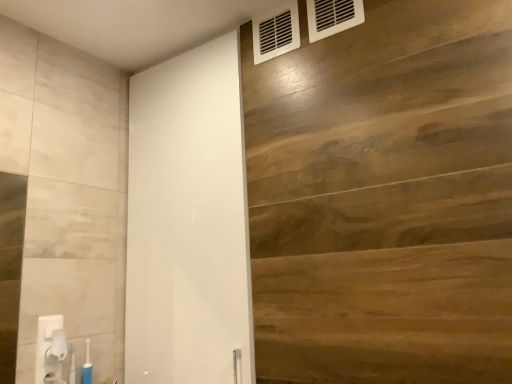
Question: From the image's perspective, is white glossy barn door at center located beneath white plastic vent at upper right, which is the 2th air conditioning from front to back?

Choices:
 (A) no
 (B) yes

Answer: (B)

Question: From the image's perspective, would you say white glossy barn door at center is positioned over white plastic vent at upper right, the 1th air conditioning when ordered from back to front?

Choices:
 (A) no
 (B) yes

Answer: (A)

Question: Does white glossy barn door at center appear on the right side of white plastic vent at upper right, placed as the 1th air conditioning when sorted from left to right?

Choices:
 (A) yes
 (B) no

Answer: (B)

Question: Does white glossy barn door at center appear on the left side of white plastic vent at upper right, which is the 2th air conditioning from front to back?

Choices:
 (A) yes
 (B) no

Answer: (A)

Question: From a real-world perspective, is white glossy barn door at center positioned under white plastic vent at upper right, the 1th air conditioning when ordered from back to front, based on gravity?

Choices:
 (A) yes
 (B) no

Answer: (A)

Question: Is wooden panel at upper right bigger or smaller than white plastic air conditioning at upper right, the first air conditioning positioned from the right?

Choices:
 (A) small
 (B) big

Answer: (B)

Question: Is wooden panel at upper right inside or outside of white plastic air conditioning at upper right, the first air conditioning positioned from the right?

Choices:
 (A) outside
 (B) inside

Answer: (A)

Question: From the image's perspective, is wooden panel at upper right above or below white plastic air conditioning at upper right, acting as the 2th air conditioning starting from the left?

Choices:
 (A) below
 (B) above

Answer: (A)

Question: From a real-world perspective, relative to white plastic air conditioning at upper right, which appears as the first air conditioning when viewed from the front, is wooden panel at upper right vertically above or below?

Choices:
 (A) above
 (B) below

Answer: (B)

Question: In the image, is white glossy barn door at center positioned in front of or behind wooden panel at upper right?

Choices:
 (A) front
 (B) behind

Answer: (B)

Question: Is white glossy barn door at center inside or outside of wooden panel at upper right?

Choices:
 (A) inside
 (B) outside

Answer: (B)

Question: Considering the positions of white glossy barn door at center and wooden panel at upper right in the image, is white glossy barn door at center bigger or smaller than wooden panel at upper right?

Choices:
 (A) small
 (B) big

Answer: (B)

Question: Is point (202, 54) closer or farther from the camera than point (361, 286)?

Choices:
 (A) farther
 (B) closer

Answer: (A)

Question: From a real-world perspective, relative to white plastic towel bar at lower left, is white plastic vent at upper right, which is the 2th air conditioning from front to back, vertically above or below?

Choices:
 (A) above
 (B) below

Answer: (A)

Question: Is white plastic vent at upper right, placed as the 1th air conditioning when sorted from left to right, wider or thinner than white plastic towel bar at lower left?

Choices:
 (A) thin
 (B) wide

Answer: (A)